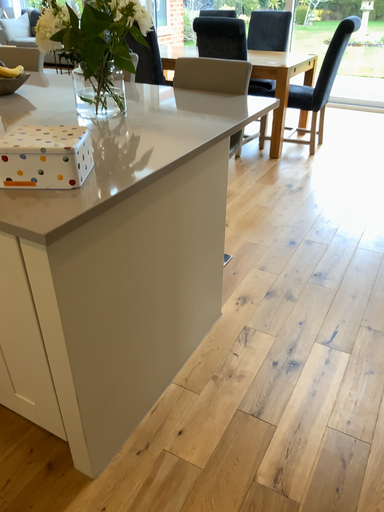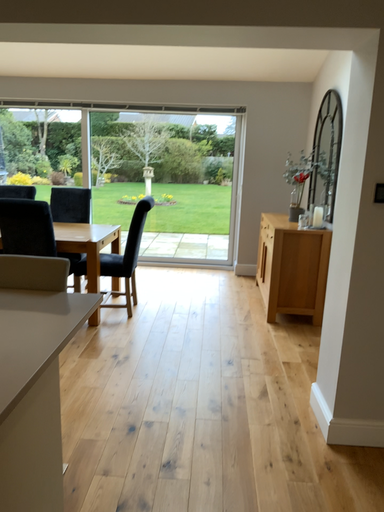
Question: How did the camera likely rotate when shooting the video?

Choices:
 (A) rotated left
 (B) rotated right

Answer: (B)